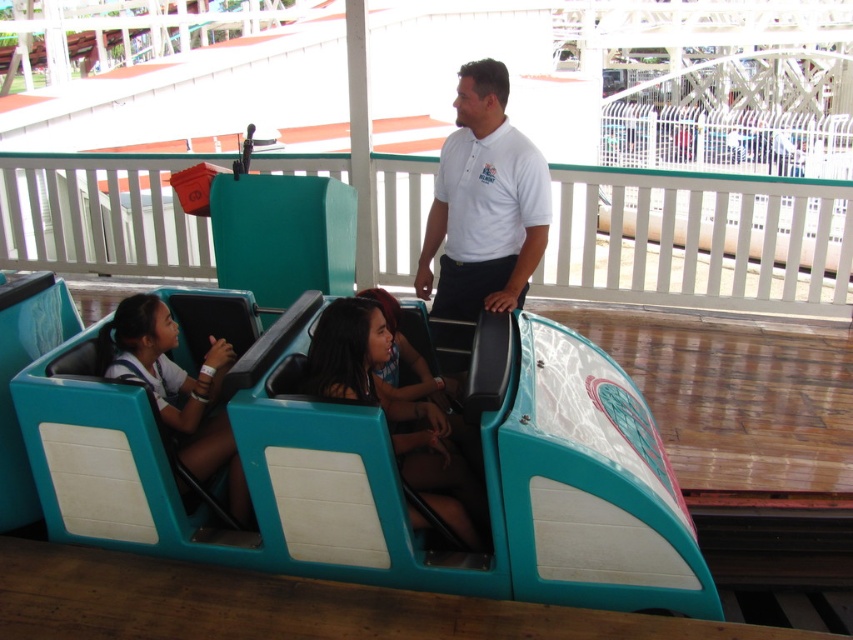
You are a maintenance worker inspecting the ride vehicle. You notice the matte teal seat at center and the white matte shirt at center. Which object is taller?

The white matte shirt at center is taller than the matte teal seat at center.